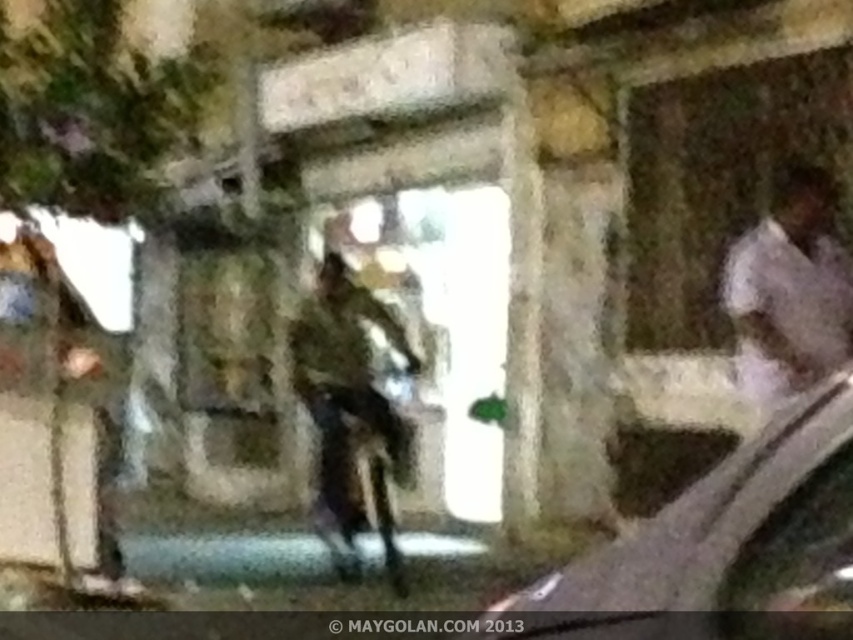
Between metallic silver car at center and camouflage fabric uniform at center, which one has less height?

metallic silver car at center

Between point (607, 573) and point (352, 416), which one is positioned behind?

The point (352, 416) is behind.

This screenshot has width=853, height=640. I want to click on metallic silver car at center, so click(x=688, y=529).

Is metallic silver car at center to the right of white fabric shirt at right from the viewer's perspective?

No, metallic silver car at center is not to the right of white fabric shirt at right.

You are a GUI agent. You are given a task and a screenshot of the screen. Output one action in this format:
    pyautogui.click(x=<x>, y=<y>)
    Task: Click on the metallic silver car at center
    The height and width of the screenshot is (640, 853).
    Given the screenshot: What is the action you would take?
    pyautogui.click(x=688, y=529)

Is point (524, 604) behind point (827, 179)?

No, it is in front of (827, 179).

At what (x,y) coordinates should I click in order to perform the action: click on metallic silver car at center. Please return your answer as a coordinate pair (x, y). Looking at the image, I should click on (688, 529).

Is camouflage fabric uniform at center taller than white fabric shirt at right?

Yes.

Which is more to the right, camouflage fabric uniform at center or white fabric shirt at right?

From the viewer's perspective, white fabric shirt at right appears more on the right side.

Locate an element on the screen. The width and height of the screenshot is (853, 640). camouflage fabric uniform at center is located at coordinates (352, 413).

At what (x,y) coordinates should I click in order to perform the action: click on camouflage fabric uniform at center. Please return your answer as a coordinate pair (x, y). Looking at the image, I should click on (352, 413).